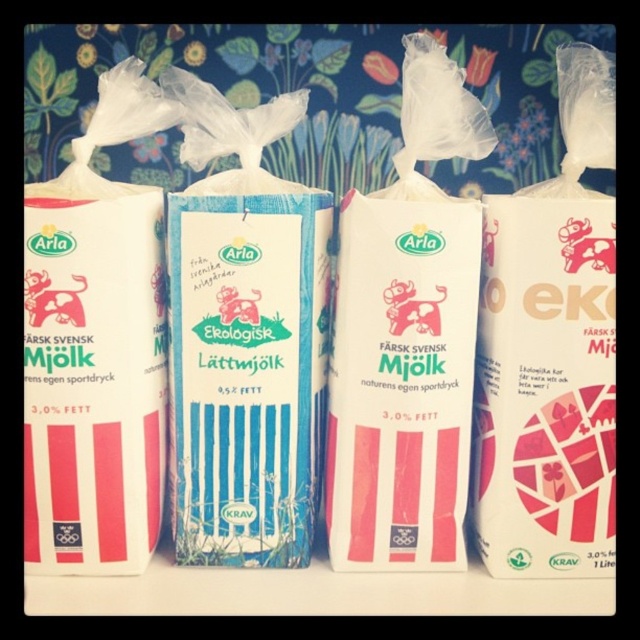
You are standing in front of the four Arla milk cartons arranged side by side. You see two points labeled as point (397, 161) and point (61, 387). Which point is closer to you?

Point (397, 161) is further to the viewer than point (61, 387), so the point closer to you is point (61, 387).

You are organizing a grocery store shelf and need to place the matte white milk carton at center and the pink paper carton at right. According to the arrangement shown, which carton should be placed to the left side of the shelf?

The matte white milk carton at center should be placed to the left side of the shelf because it is positioned to the left of the pink paper carton at right in the image.

You are arranging these milk cartons on a shelf. If you want to place the blue striped carton at center above the matte white milk carton at left, is that possible without moving other cartons?

The blue striped carton at center is currently below the matte white milk carton at left. To place it above, you would need to move other cartons out of the way since they are positioned side by side.